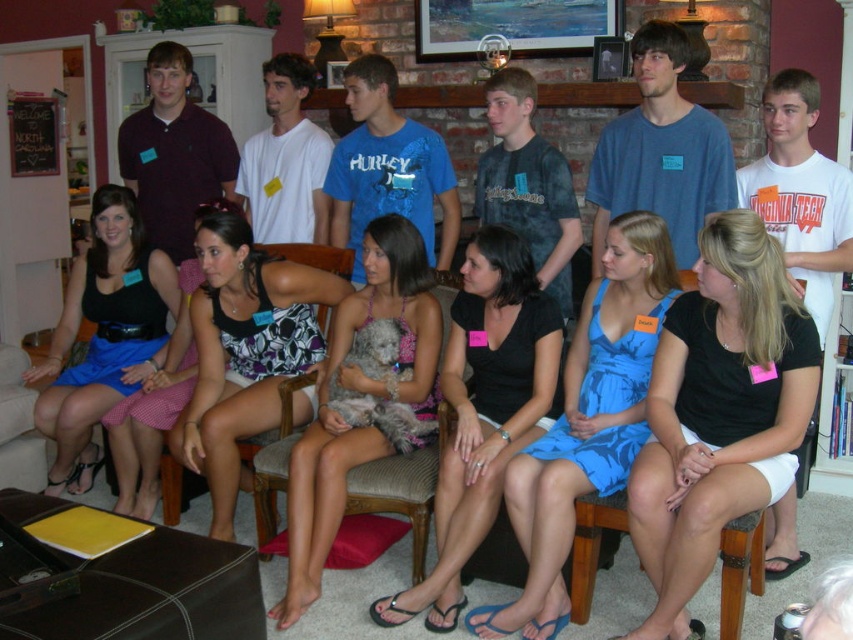
You are organizing a fashion show and need to decide which garment to display first. The black matte dress at center and the printed fabric tank top at center are both options. Based on their physical dimensions, which one should you choose if you want to start with the narrower item?

The black matte dress at center is thinner than the printed fabric tank top at center, so you should choose the black matte dress at center to display first as it is narrower.

You are organizing a photoshoot and need to ensure that the black matte dress at center and the blue cotton shirt at upper center are visible in the frame. Based on their positions, which clothing item is located lower in the image?

The black matte dress at center is positioned under the blue cotton shirt at upper center, so the black matte dress at center is located lower in the image.